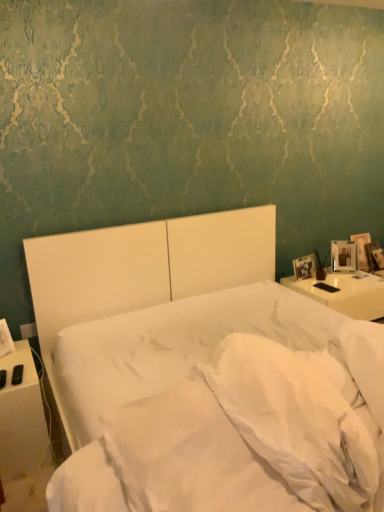
This screenshot has width=384, height=512. Describe the element at coordinates (365, 362) in the screenshot. I see `white soft pillow at lower right, arranged as the second pillow when viewed from the left` at that location.

Locate an element on the screen. This screenshot has height=512, width=384. white matte bed at center is located at coordinates (204, 373).

At what (x,y) coordinates should I click in order to perform the action: click on white plastic remote at left, the second nightstand viewed from the back. Please return your answer as a coordinate pair (x, y). The width and height of the screenshot is (384, 512). Looking at the image, I should click on (21, 417).

The width and height of the screenshot is (384, 512). In order to click on white soft pillow at center, marked as the 2th pillow in a right-to-left arrangement in this screenshot , I will do `click(297, 418)`.

Considering the relative sizes of white matte bed at center and white glossy nightstand at right, marked as the 2th nightstand in a front-to-back arrangement, in the image provided, is white matte bed at center taller than white glossy nightstand at right, marked as the 2th nightstand in a front-to-back arrangement,?

A: Correct, white matte bed at center is much taller as white glossy nightstand at right, marked as the 2th nightstand in a front-to-back arrangement.

From the image's perspective, is white matte bed at center under white glossy nightstand at right, which is the 1th nightstand in back-to-front order?

Yes.

Considering the sizes of white matte bed at center and white glossy nightstand at right, which ranks as the first nightstand in right-to-left order, in the image, is white matte bed at center bigger or smaller than white glossy nightstand at right, which ranks as the first nightstand in right-to-left order,?

Clearly, white matte bed at center is larger in size than white glossy nightstand at right, which ranks as the first nightstand in right-to-left order.

Is the position of white glossy nightstand at right, marked as the 2th nightstand in a front-to-back arrangement, less distant than that of white soft pillow at center, marked as the first pillow in a left-to-right arrangement?

No, white glossy nightstand at right, marked as the 2th nightstand in a front-to-back arrangement, is further to the viewer.

Is white glossy nightstand at right, placed as the 2th nightstand when sorted from left to right, wider than white soft pillow at center, marked as the first pillow in a left-to-right arrangement?

Correct, the width of white glossy nightstand at right, placed as the 2th nightstand when sorted from left to right, exceeds that of white soft pillow at center, marked as the first pillow in a left-to-right arrangement.

Between white glossy nightstand at right, marked as the 2th nightstand in a front-to-back arrangement, and white soft pillow at center, marked as the first pillow in a left-to-right arrangement, which one has larger size?

white glossy nightstand at right, marked as the 2th nightstand in a front-to-back arrangement.

Is white glossy nightstand at right, which ranks as the first nightstand in right-to-left order, positioned with its back to white soft pillow at center, marked as the first pillow in a left-to-right arrangement?

That's not correct — white glossy nightstand at right, which ranks as the first nightstand in right-to-left order, is not looking away from white soft pillow at center, marked as the first pillow in a left-to-right arrangement.

Is white soft pillow at lower right, arranged as the second pillow when viewed from the left, to the right of white glossy nightstand at right, marked as the 2th nightstand in a front-to-back arrangement, from the viewer's perspective?

In fact, white soft pillow at lower right, arranged as the second pillow when viewed from the left, is to the left of white glossy nightstand at right, marked as the 2th nightstand in a front-to-back arrangement.

From the image's perspective, between white soft pillow at lower right, arranged as the second pillow when viewed from the left, and white glossy nightstand at right, marked as the 2th nightstand in a front-to-back arrangement, who is located below?

From the image's view, white soft pillow at lower right, arranged as the second pillow when viewed from the left, is below.

Is white soft pillow at lower right, which is the first pillow in right-to-left order, positioned with its back to white glossy nightstand at right, marked as the 2th nightstand in a front-to-back arrangement?

No, white soft pillow at lower right, which is the first pillow in right-to-left order, is not facing away from white glossy nightstand at right, marked as the 2th nightstand in a front-to-back arrangement.

Considering the positions of point (352, 339) and point (377, 292), is point (352, 339) closer or farther from the camera than point (377, 292)?

Point (352, 339).

Can you tell me how much white matte bed at center and white plastic remote at left, the second nightstand viewed from the right, differ in facing direction?

The angular difference between white matte bed at center and white plastic remote at left, the second nightstand viewed from the right, is 0.59 degrees.

Considering the relative positions of white matte bed at center and white plastic remote at left, positioned as the 1th nightstand in front-to-back order, in the image provided, is white matte bed at center to the right of white plastic remote at left, positioned as the 1th nightstand in front-to-back order, from the viewer's perspective?

Indeed, white matte bed at center is positioned on the right side of white plastic remote at left, positioned as the 1th nightstand in front-to-back order.

Is white matte bed at center taller or shorter than white plastic remote at left, the first nightstand from the left?

Clearly, white matte bed at center is taller compared to white plastic remote at left, the first nightstand from the left.

Is white matte bed at center in front of white plastic remote at left, the second nightstand viewed from the right?

Yes.

Which of these two, white glossy nightstand at right, marked as the 2th nightstand in a front-to-back arrangement, or white matte bed at center, is smaller?

Smaller between the two is white glossy nightstand at right, marked as the 2th nightstand in a front-to-back arrangement.

Can you confirm if white glossy nightstand at right, which ranks as the first nightstand in right-to-left order, is wider than white matte bed at center?

In fact, white glossy nightstand at right, which ranks as the first nightstand in right-to-left order, might be narrower than white matte bed at center.

Who is shorter, white glossy nightstand at right, placed as the 2th nightstand when sorted from left to right, or white matte bed at center?

white glossy nightstand at right, placed as the 2th nightstand when sorted from left to right.

From the image's perspective, is white glossy nightstand at right, marked as the 2th nightstand in a front-to-back arrangement, positioned above or below white matte bed at center?

white glossy nightstand at right, marked as the 2th nightstand in a front-to-back arrangement, is above white matte bed at center.

From the image's perspective, is white soft pillow at center, marked as the first pillow in a left-to-right arrangement, under white soft pillow at lower right, which is the first pillow in right-to-left order?

Yes, from the image's perspective, white soft pillow at center, marked as the first pillow in a left-to-right arrangement, is beneath white soft pillow at lower right, which is the first pillow in right-to-left order.

Does white soft pillow at center, marked as the first pillow in a left-to-right arrangement, appear on the right side of white soft pillow at lower right, arranged as the second pillow when viewed from the left?

No, white soft pillow at center, marked as the first pillow in a left-to-right arrangement, is not to the right of white soft pillow at lower right, arranged as the second pillow when viewed from the left.

From the picture: Is white soft pillow at center, marked as the 2th pillow in a right-to-left arrangement, facing towards white soft pillow at lower right, which is the first pillow in right-to-left order?

Yes, white soft pillow at center, marked as the 2th pillow in a right-to-left arrangement, is aimed at white soft pillow at lower right, which is the first pillow in right-to-left order.

Is white soft pillow at center, marked as the first pillow in a left-to-right arrangement, touching white soft pillow at lower right, which is the first pillow in right-to-left order?

white soft pillow at center, marked as the first pillow in a left-to-right arrangement, is not next to white soft pillow at lower right, which is the first pillow in right-to-left order, and they're not touching.

From the image's perspective, does white soft pillow at center, marked as the 2th pillow in a right-to-left arrangement, appear higher than white matte bed at center?

Correct, white soft pillow at center, marked as the 2th pillow in a right-to-left arrangement, appears higher than white matte bed at center in the image.

How far apart are white soft pillow at center, marked as the first pillow in a left-to-right arrangement, and white matte bed at center?

white soft pillow at center, marked as the first pillow in a left-to-right arrangement, and white matte bed at center are 33.77 centimeters apart.

Does white soft pillow at center, marked as the 2th pillow in a right-to-left arrangement, come in front of white matte bed at center?

No.

Where is `pillow that is on the left side of white matte bed at center`? This screenshot has width=384, height=512. pillow that is on the left side of white matte bed at center is located at coordinates (297, 418).

Locate an element on the screen. This screenshot has width=384, height=512. bed below the white glossy nightstand at right, which ranks as the first nightstand in right-to-left order (from the image's perspective) is located at coordinates 204,373.

Locate an element on the screen. nightstand located above the white soft pillow at center, marked as the 2th pillow in a right-to-left arrangement (from the image's perspective) is located at coordinates (345, 293).

Estimate the real-world distances between objects in this image. Which object is further from white soft pillow at center, marked as the first pillow in a left-to-right arrangement, white matte bed at center or white soft pillow at lower right, arranged as the second pillow when viewed from the left?

white matte bed at center.

When comparing their distances from white matte bed at center, does white plastic remote at left, the second nightstand viewed from the back, or white soft pillow at lower right, arranged as the second pillow when viewed from the left, seem further?

white plastic remote at left, the second nightstand viewed from the back, is positioned further to the anchor white matte bed at center.

Based on the photo, which object lies further to the anchor point white matte bed at center, white soft pillow at lower right, arranged as the second pillow when viewed from the left, or white soft pillow at center, marked as the 2th pillow in a right-to-left arrangement?

white soft pillow at lower right, arranged as the second pillow when viewed from the left, is further to white matte bed at center.

Considering their positions, is white glossy nightstand at right, which ranks as the first nightstand in right-to-left order, positioned closer to white plastic remote at left, the second nightstand viewed from the right, than white soft pillow at lower right, arranged as the second pillow when viewed from the left?

The object closer to white plastic remote at left, the second nightstand viewed from the right, is white soft pillow at lower right, arranged as the second pillow when viewed from the left.

Estimate the real-world distances between objects in this image. Which object is further from white soft pillow at lower right, arranged as the second pillow when viewed from the left, white glossy nightstand at right, marked as the 2th nightstand in a front-to-back arrangement, or white matte bed at center?

white glossy nightstand at right, marked as the 2th nightstand in a front-to-back arrangement, is further to white soft pillow at lower right, arranged as the second pillow when viewed from the left.

Considering their positions, is white soft pillow at center, marked as the 2th pillow in a right-to-left arrangement, positioned further to white soft pillow at lower right, arranged as the second pillow when viewed from the left, than white glossy nightstand at right, placed as the 2th nightstand when sorted from left to right?

white glossy nightstand at right, placed as the 2th nightstand when sorted from left to right, lies further to white soft pillow at lower right, arranged as the second pillow when viewed from the left, than the other object.

When comparing their distances from white soft pillow at lower right, which is the first pillow in right-to-left order, does white soft pillow at center, marked as the 2th pillow in a right-to-left arrangement, or white plastic remote at left, positioned as the 1th nightstand in front-to-back order, seem closer?

white soft pillow at center, marked as the 2th pillow in a right-to-left arrangement, is closer to white soft pillow at lower right, which is the first pillow in right-to-left order.

Estimate the real-world distances between objects in this image. Which object is closer to white glossy nightstand at right, placed as the 2th nightstand when sorted from left to right, white soft pillow at center, marked as the first pillow in a left-to-right arrangement, or white soft pillow at lower right, arranged as the second pillow when viewed from the left?

white soft pillow at lower right, arranged as the second pillow when viewed from the left.

This screenshot has height=512, width=384. What are the coordinates of `pillow between white matte bed at center and white soft pillow at lower right, arranged as the second pillow when viewed from the left, along the z-axis` in the screenshot? It's located at (297, 418).

Find the location of `bed located between white plastic remote at left, the second nightstand viewed from the back, and white soft pillow at lower right, which is the first pillow in right-to-left order, in the left-right direction`. bed located between white plastic remote at left, the second nightstand viewed from the back, and white soft pillow at lower right, which is the first pillow in right-to-left order, in the left-right direction is located at coordinates (204, 373).

Where is `nightstand between white matte bed at center and white glossy nightstand at right, which is the 1th nightstand in back-to-front order, along the z-axis`? The image size is (384, 512). nightstand between white matte bed at center and white glossy nightstand at right, which is the 1th nightstand in back-to-front order, along the z-axis is located at coordinates (21, 417).

You are a GUI agent. You are given a task and a screenshot of the screen. Output one action in this format:
    pyautogui.click(x=<x>, y=<y>)
    Task: Click on the pillow between white soft pillow at center, marked as the first pillow in a left-to-right arrangement, and white glossy nightstand at right, which ranks as the first nightstand in right-to-left order, along the z-axis
    This screenshot has width=384, height=512.
    Given the screenshot: What is the action you would take?
    pyautogui.click(x=365, y=362)